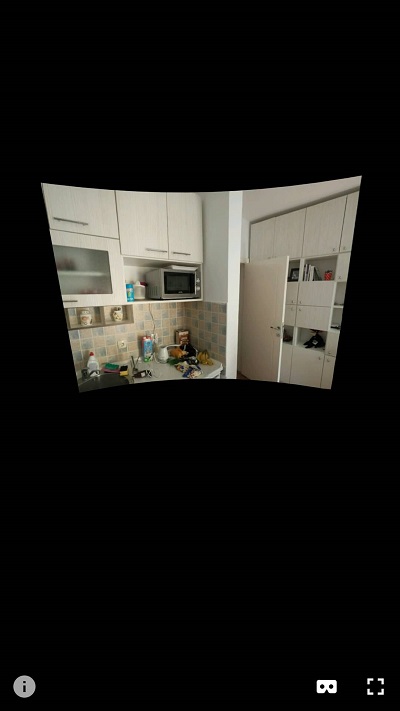
What are the coordinates of `small white door slightly open` in the screenshot? It's located at [259, 310].